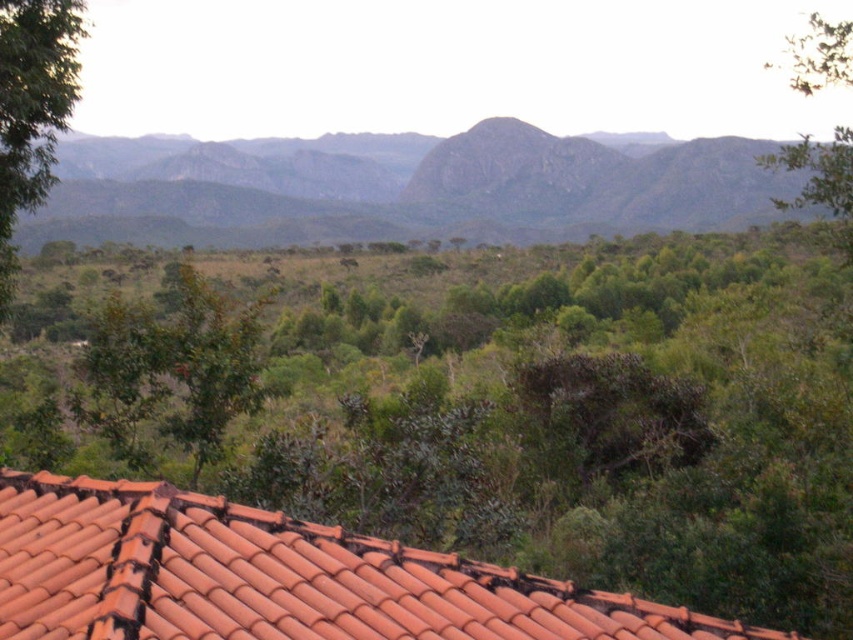
Question: Where is terracotta tiles at lower center located in relation to rugged granite mountain at center in the image?

Choices:
 (A) above
 (B) below

Answer: (B)

Question: Which object is positioned closest to the rugged granite mountain at center?

Choices:
 (A) terracotta tiles at lower center
 (B) green leafy tree at left

Answer: (B)

Question: Does rugged granite mountain at center appear on the right side of green leafy tree at left?

Choices:
 (A) no
 (B) yes

Answer: (B)

Question: Among these objects, which one is nearest to the camera?

Choices:
 (A) green leafy tree at left
 (B) rugged granite mountain at center

Answer: (A)

Question: Among these objects, which one is nearest to the camera?

Choices:
 (A) rugged granite mountain at center
 (B) terracotta tiles at lower center
 (C) green leafy tree at left

Answer: (B)

Question: Can you confirm if terracotta tiles at lower center is wider than green leafy tree at left?

Choices:
 (A) yes
 (B) no

Answer: (A)